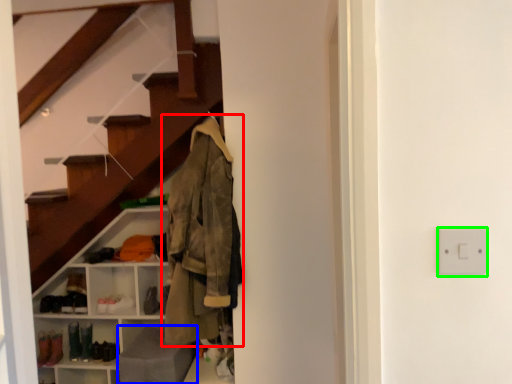
Question: Which is nearer to the jacket (highlighted by a red box)? gray (highlighted by a blue box) or electric outlet (highlighted by a green box).

Choices:
 (A) gray
 (B) electric outlet

Answer: (A)